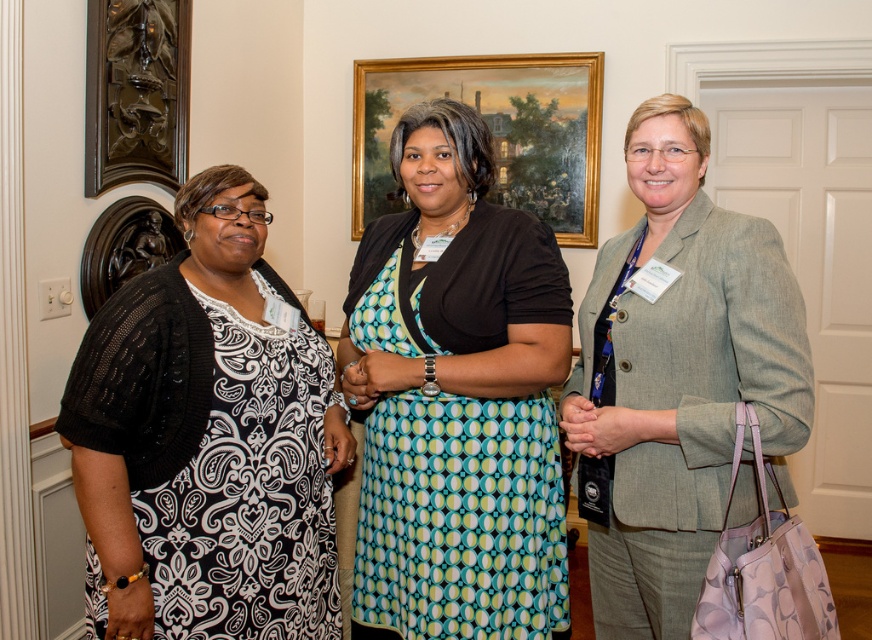
You are at a formal event and need to identify where the dark brown carved wood at upper left is located relative to the black knit cardigan at left. Is it behind or in front of it?

The black knit cardigan at left is in front of the dark brown carved wood at upper left, so the dark brown carved wood at upper left is behind it.

You are a photographer at the event and need to adjust the lighting to ensure both the teal dotted dress at center and the gray wool blazer at center are well lit. Given their positions, which one should you focus on first to ensure proper exposure?

Answer: The teal dotted dress at center is positioned under the gray wool blazer at center, so you should focus on the gray wool blazer at center first to ensure it receives adequate light before adjusting for the dress underneath.